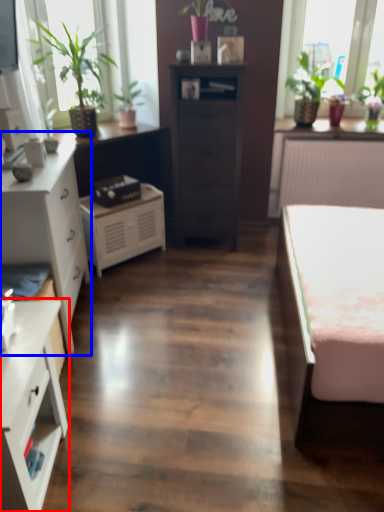
Question: Which object appears farthest to the camera in this image, chest of drawers (highlighted by a red box) or chest of drawers (highlighted by a blue box)?

Choices:
 (A) chest of drawers
 (B) chest of drawers

Answer: (B)